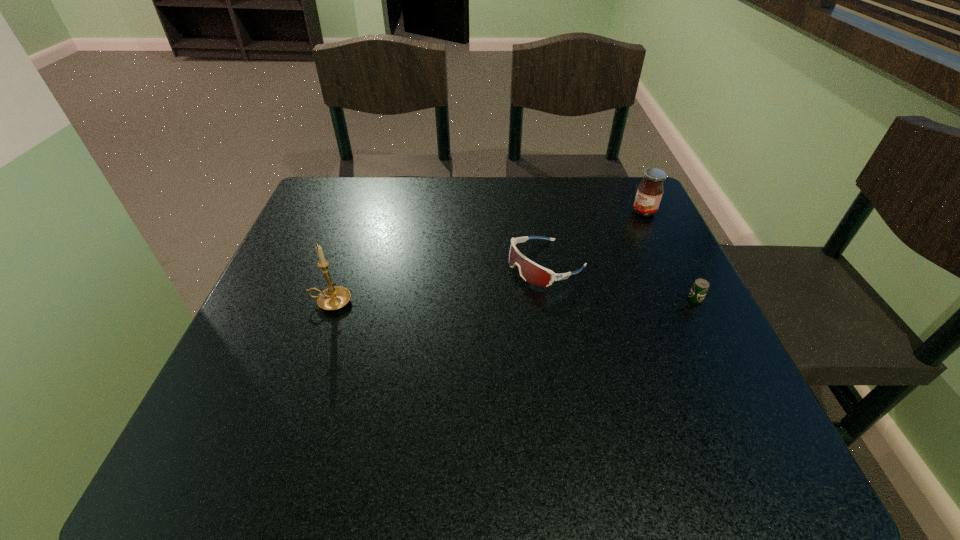
Where is `the tallest object`? the tallest object is located at coordinates (333, 298).

This screenshot has height=540, width=960. Find the location of `the leftmost object`. the leftmost object is located at coordinates (333, 298).

Locate an element on the screen. beer can is located at coordinates tap(700, 287).

At what (x,y) coordinates should I click in order to perform the action: click on the second shortest object. Please return your answer as a coordinate pair (x, y). Looking at the image, I should click on (531, 272).

Where is `the second object from left to right`? the second object from left to right is located at coordinates (531, 272).

Find the location of a particular element. Image resolution: width=960 pixels, height=540 pixels. the second tallest object is located at coordinates (649, 193).

You are a GUI agent. You are given a task and a screenshot of the screen. Output one action in this format:
    pyautogui.click(x=<x>, y=<y>)
    Task: Click on the jam
    
    Given the screenshot: What is the action you would take?
    pyautogui.click(x=649, y=193)

This screenshot has height=540, width=960. What are the coordinates of `vacant region located 0.160m on the front of the beer can` in the screenshot? It's located at (738, 386).

Identify the location of free space located 0.290m on the front-facing side of the third object from right to left. The height and width of the screenshot is (540, 960). (392, 337).

Locate an element on the screen. free space located on the front-facing side of the third object from right to left is located at coordinates (485, 293).